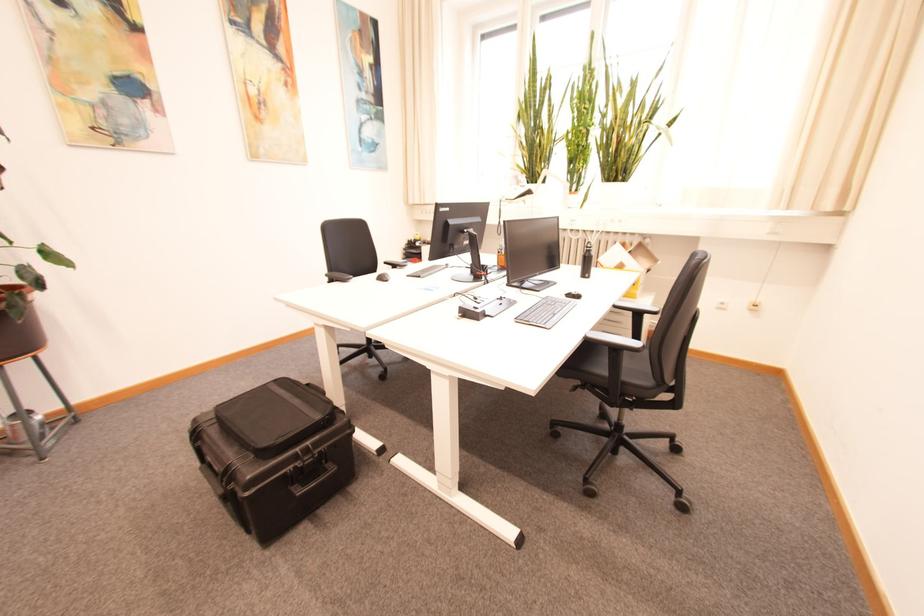
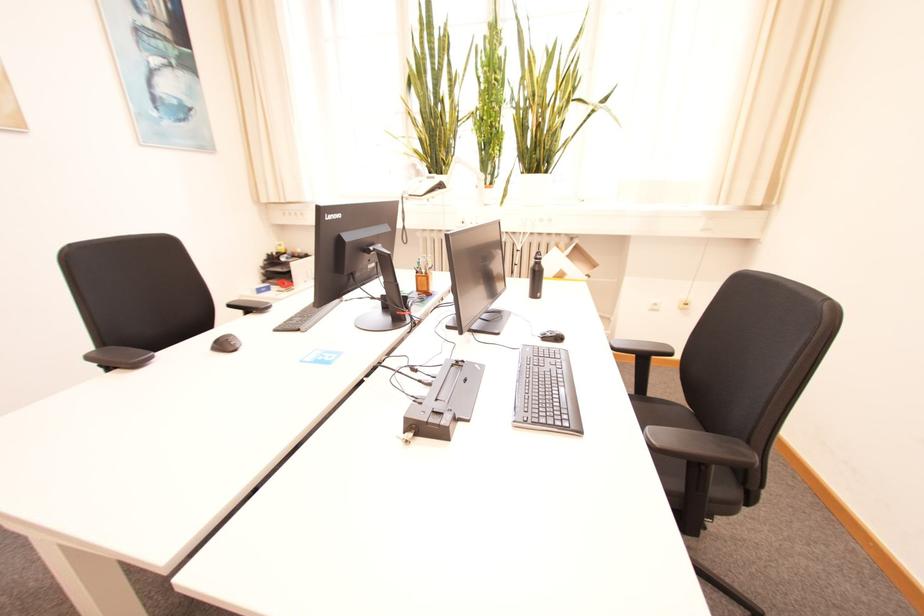
The point at [504,253] is marked in the first image. Where is the corresponding point in the second image?

(421, 273)